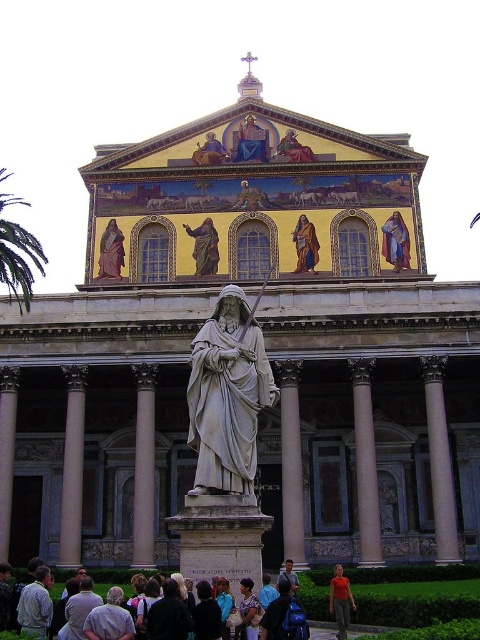
Based on the photo, is smooth marble column at center further to camera compared to gold leaf robe at center?

That is False.

This screenshot has width=480, height=640. Describe the element at coordinates (144, 467) in the screenshot. I see `smooth marble column at center` at that location.

Identify the location of smooth marble column at center. Image resolution: width=480 pixels, height=640 pixels. (144, 467).

Is point (12, 486) closer to camera compared to point (118, 276)?

That is True.

Measure the distance between point (0, 460) and camera.

Point (0, 460) is 56.05 meters away from camera.

Where is `white marble pillar at center`? The width and height of the screenshot is (480, 640). white marble pillar at center is located at coordinates (7, 451).

Based on the photo, between white marble column at center and smooth marble column at center, which one has less height?

With less height is smooth marble column at center.

Which is in front, point (357, 403) or point (140, 442)?

Point (140, 442) is more forward.

Between point (369, 515) and point (135, 492), which one is positioned in front?

Point (369, 515) is more forward.

This screenshot has width=480, height=640. What are the coordinates of `white marble column at center` in the screenshot? It's located at (365, 465).